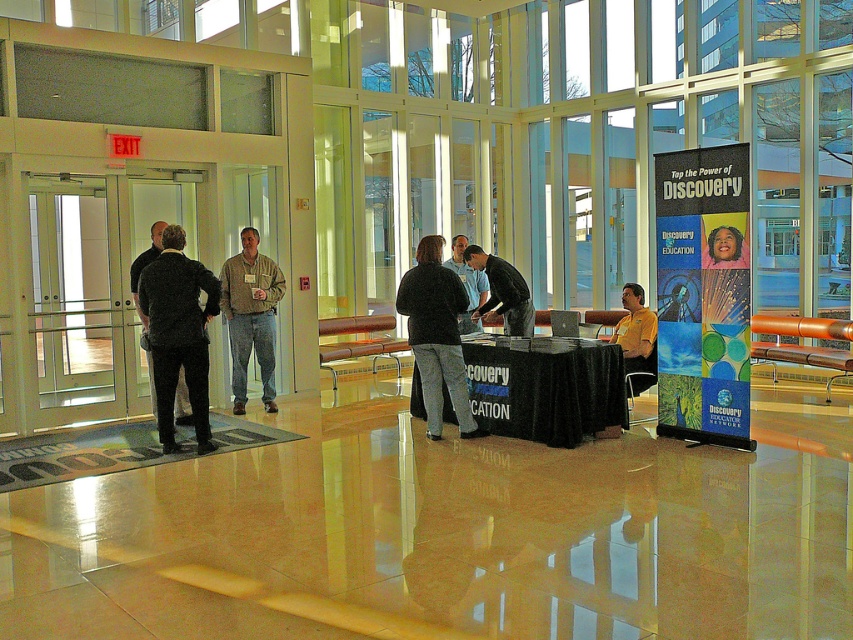
You are a photographer standing at the back of the room. You want to take a photo that includes both the khaki cotton shirt at center and the dark gray suit at left. The minimum distance between them for the photo to include both is 40 inches. Can you capture both in the same frame?

The khaki cotton shirt at center and dark gray suit at left are 39.37 inches apart from each other, which is less than the required 40 inches. Therefore, you can capture both in the same frame.

You are planning to place a large banner on the black clothed table at center. Considering the dark gray suit at left is currently occupying space near the table, do you think the banner will fit on the table without needing to move the suit?

The black clothed table at center is wider than the dark gray suit at left, so the banner should fit comfortably without needing to move the suit.

You are a photographer standing at the back of the lobby. You want to take a photo of the dark gray sweater at center and the black clothed table at center without any obstruction. Which object should you position closer to the camera to ensure both are fully visible?

The dark gray sweater at center has a greater height compared to the black clothed table at center. To ensure both are fully visible without obstruction, position the dark gray sweater at center closer to the camera since its height might block the view of the lower black clothed table at center if placed behind.